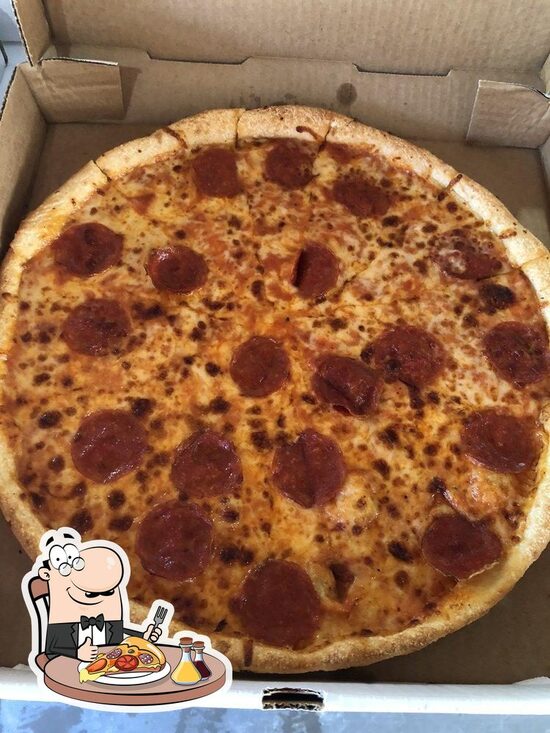
Find the location of a particular element. The height and width of the screenshot is (733, 550). cartoon chair is located at coordinates (65, 668).